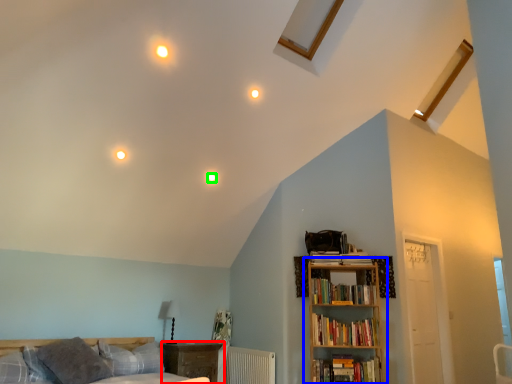
Question: Estimate the real-world distances between objects in this image. Which object is closer to nightstand (highlighted by a red box), bookcase (highlighted by a blue box) or lighting (highlighted by a green box)?

Choices:
 (A) bookcase
 (B) lighting

Answer: (A)